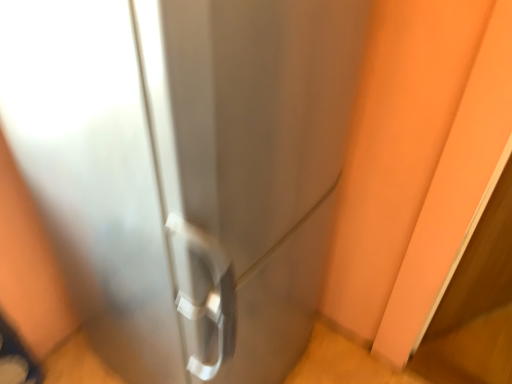
The height and width of the screenshot is (384, 512). What do you see at coordinates (185, 169) in the screenshot? I see `satin silver refrigerator at center` at bounding box center [185, 169].

Where is `satin silver refrigerator at center`? satin silver refrigerator at center is located at coordinates (185, 169).

Locate an element on the screen. The width and height of the screenshot is (512, 384). satin silver refrigerator at center is located at coordinates (185, 169).